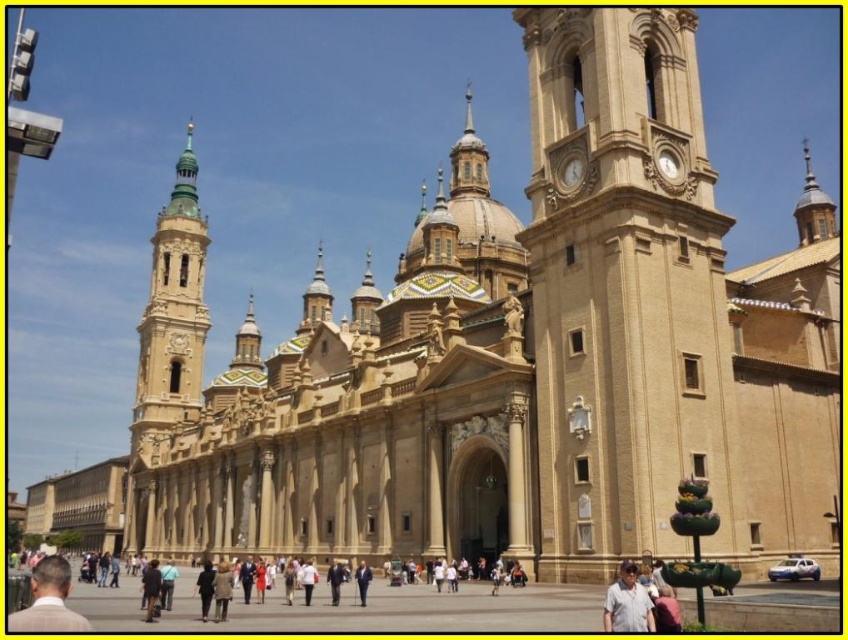
Is green glazed tile tower at upper left positioned at the back of light brown leather jacket at center?

Yes.

Is point (193, 356) closer to viewer compared to point (364, 593)?

No, (193, 356) is further to viewer.

The image size is (848, 640). Identify the location of green glazed tile tower at upper left. (171, 316).

Where is `green glazed tile tower at upper left`? The height and width of the screenshot is (640, 848). green glazed tile tower at upper left is located at coordinates (171, 316).

Which is above, green glazed tile tower at upper left or dark brown leather jacket at lower left?

green glazed tile tower at upper left is above.

Can you confirm if green glazed tile tower at upper left is thinner than dark brown leather jacket at lower left?

In fact, green glazed tile tower at upper left might be wider than dark brown leather jacket at lower left.

The height and width of the screenshot is (640, 848). I want to click on green glazed tile tower at upper left, so click(x=171, y=316).

Is beige brick clock tower at center above light brown suit at lower left?

Yes.

Who is positioned more to the left, beige brick clock tower at center or light brown suit at lower left?

light brown suit at lower left

Which is behind, point (724, 392) or point (48, 624)?

The point (724, 392) is more distant.

Locate an element on the screen. This screenshot has height=640, width=848. beige brick clock tower at center is located at coordinates (623, 291).